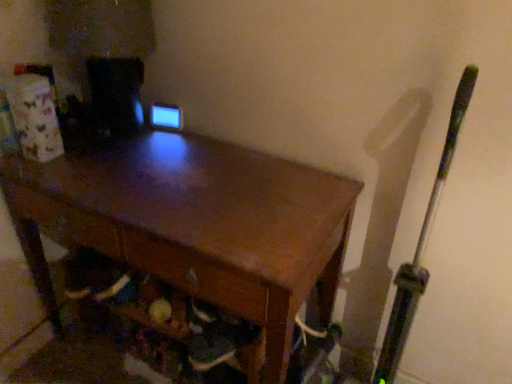
Question: Considering the relative sizes of green metallic bat at right and wooden desk at center in the image provided, is green metallic bat at right wider than wooden desk at center?

Choices:
 (A) no
 (B) yes

Answer: (A)

Question: From a real-world perspective, is green metallic bat at right located beneath wooden desk at center?

Choices:
 (A) yes
 (B) no

Answer: (B)

Question: Can you confirm if green metallic bat at right is positioned to the right of wooden desk at center?

Choices:
 (A) no
 (B) yes

Answer: (B)

Question: Considering the relative sizes of green metallic bat at right and wooden desk at center in the image provided, is green metallic bat at right taller than wooden desk at center?

Choices:
 (A) no
 (B) yes

Answer: (B)

Question: Is green metallic bat at right aimed at wooden desk at center?

Choices:
 (A) yes
 (B) no

Answer: (B)

Question: From a real-world perspective, is wooden desk at center physically located above or below green metallic bat at right?

Choices:
 (A) below
 (B) above

Answer: (A)

Question: In terms of size, does wooden desk at center appear bigger or smaller than green metallic bat at right?

Choices:
 (A) big
 (B) small

Answer: (A)

Question: Considering the positions of wooden desk at center and green metallic bat at right in the image, is wooden desk at center taller or shorter than green metallic bat at right?

Choices:
 (A) tall
 (B) short

Answer: (B)

Question: Is wooden desk at center in front of or behind green metallic bat at right in the image?

Choices:
 (A) behind
 (B) front

Answer: (A)

Question: Considering the positions of wooden desk at center and wooden drawer at lower center in the image, is wooden desk at center bigger or smaller than wooden drawer at lower center?

Choices:
 (A) small
 (B) big

Answer: (B)

Question: From the image's perspective, is wooden desk at center located above or below wooden drawer at lower center?

Choices:
 (A) above
 (B) below

Answer: (B)

Question: In the image, is wooden desk at center positioned in front of or behind wooden drawer at lower center?

Choices:
 (A) behind
 (B) front

Answer: (B)

Question: Is point (309, 208) closer or farther from the camera than point (218, 286)?

Choices:
 (A) farther
 (B) closer

Answer: (A)

Question: From a real-world perspective, is wooden drawer at lower center above or below wooden desk at center?

Choices:
 (A) above
 (B) below

Answer: (A)

Question: Is wooden drawer at lower center taller or shorter than wooden desk at center?

Choices:
 (A) short
 (B) tall

Answer: (A)